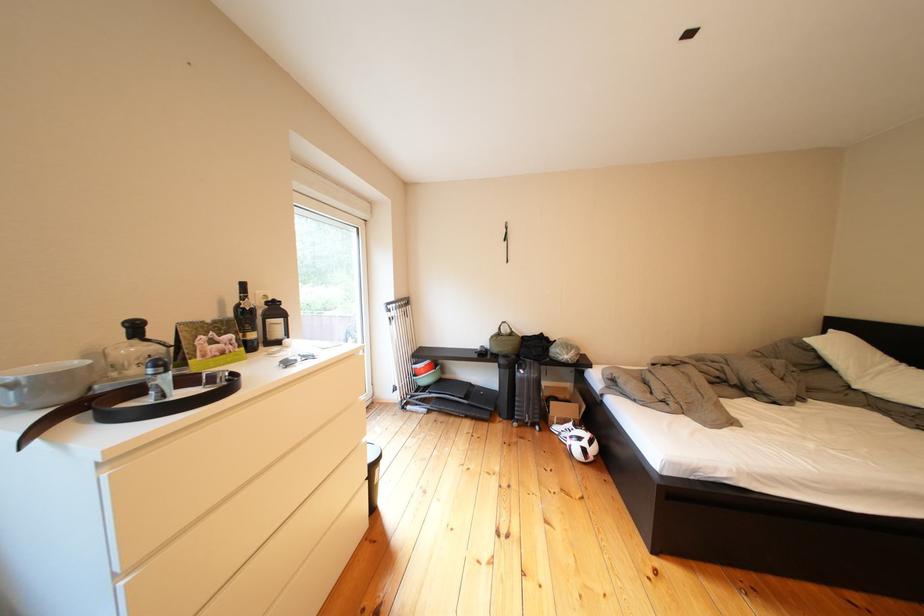
I want to click on the top drawer lip, so click(200, 466).